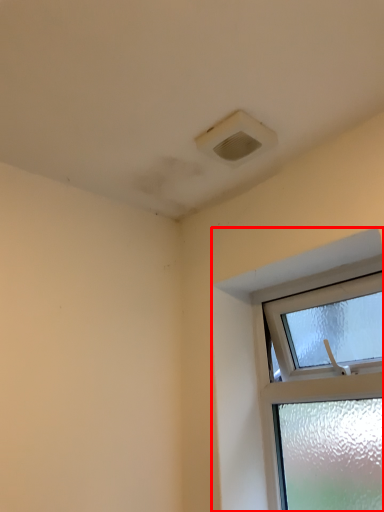
Question: From the image's perspective, where is window (annotated by the red box) located in relation to air conditioning in the image?

Choices:
 (A) below
 (B) above

Answer: (A)